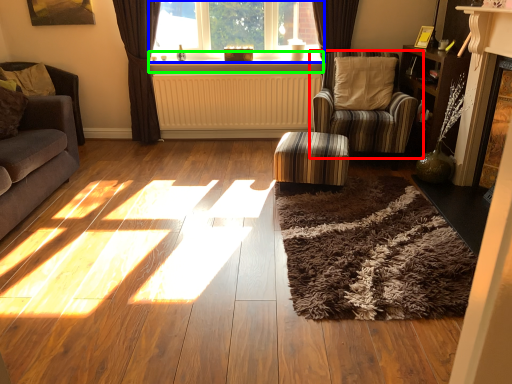
Question: Considering the real-world distances, which object is farthest from chair (highlighted by a red box)? window (highlighted by a blue box) or window sill (highlighted by a green box)?

Choices:
 (A) window
 (B) window sill

Answer: (A)